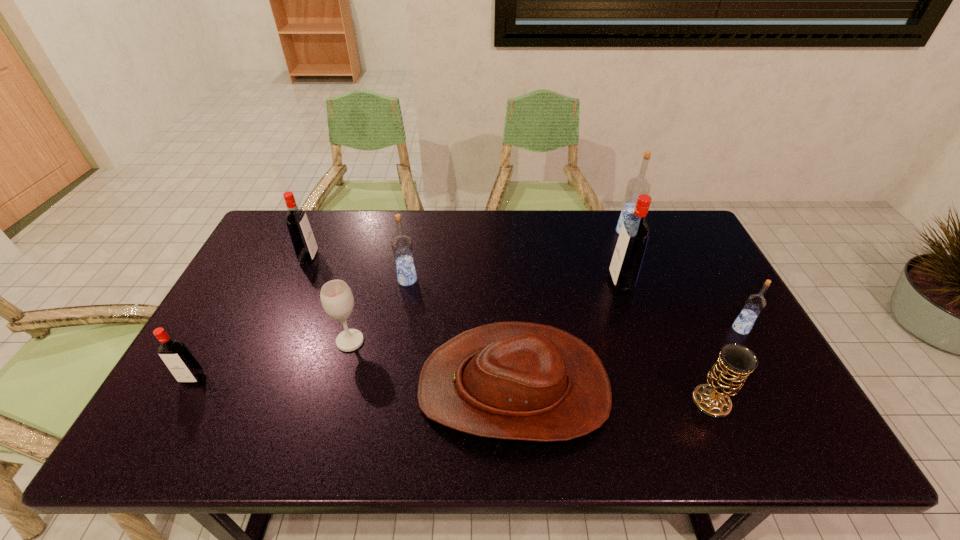
You are a GUI agent. You are given a task and a screenshot of the screen. Output one action in this format:
    pyautogui.click(x=<x>, y=<y>)
    Task: Click on the vacant space that's between the second smallest blue vodka and the fourth object from right to left
    
    Given the screenshot: What is the action you would take?
    pyautogui.click(x=514, y=281)

Identify the location of free space between the fifth farthest vodka and the fourth vodka from left to right. This screenshot has width=960, height=540. (681, 305).

At what (x,y) coordinates should I click in order to perform the action: click on free area in between the leftmost object and the shortest object. Please return your answer as a coordinate pair (x, y). The width and height of the screenshot is (960, 540). Looking at the image, I should click on (353, 383).

Where is `free space that is in between the fourth vodka from left to right and the wineglass`? This screenshot has width=960, height=540. free space that is in between the fourth vodka from left to right and the wineglass is located at coordinates (486, 312).

Image resolution: width=960 pixels, height=540 pixels. What are the coordinates of `free space between the leftmost object and the farthest object` in the screenshot? It's located at (410, 305).

You are a GUI agent. You are given a task and a screenshot of the screen. Output one action in this format:
    pyautogui.click(x=<x>, y=<y>)
    Task: Click on the vacant space in between the leftmost red vodka and the fourth vodka from left to right
    This screenshot has width=960, height=540.
    Given the screenshot: What is the action you would take?
    pyautogui.click(x=407, y=330)

This screenshot has height=540, width=960. What are the coordinates of `free spot between the fourth vodka from right to left and the second red vodka from left to right` in the screenshot? It's located at (358, 269).

Find the location of a particular element. free point between the fifth vodka from right to left and the second blue vodka from right to left is located at coordinates (468, 245).

Identify which object is located as the nearest to the chalice. Please provide its 2D coordinates. Your answer should be formatted as a tuple, i.e. [(x, y)], where the tuple contains the x and y coordinates of a point satisfying the conditions above.

[(755, 303)]

At what (x,y) coordinates should I click in order to perform the action: click on object that is the second closest one to the fourth vodka from right to left. Please return your answer as a coordinate pair (x, y). Image resolution: width=960 pixels, height=540 pixels. Looking at the image, I should click on (514, 380).